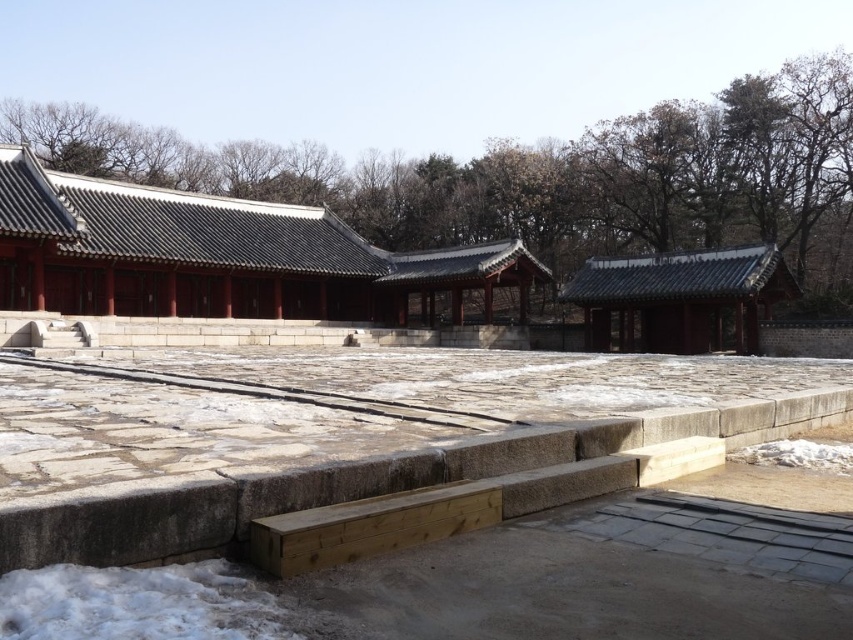
You are a visitor at the historical site and want to take a photo of the matte gray stone palace at center and the shiny dark gray roof at right. Which one should you focus on first if you want to include both in your frame without moving the camera?

You should focus on the matte gray stone palace at center first because it is positioned over the shiny dark gray roof at right, meaning it is closer to the camera and will be in the foreground. By focusing on the closer object, both will be in focus if the depth of field is sufficient.

You are standing in the courtyard of a traditional Korean palace and see a point marked at coordinates (219,256). Based on the scene description, what object does this point most likely represent?

The point at coordinates (219,256) most likely represents the matte gray stone palace at center, as the description states that this point corresponds to that object.

You are a tourist standing in the courtyard and want to take a photo of both the matte gray stone palace at center and the shiny dark gray roof at right. Which direction should you face to have both in your camera frame?

You should face to the right so that both the matte gray stone palace at center and the shiny dark gray roof at right are visible in your frame, as the matte gray stone palace at center is to the left of the shiny dark gray roof at right.